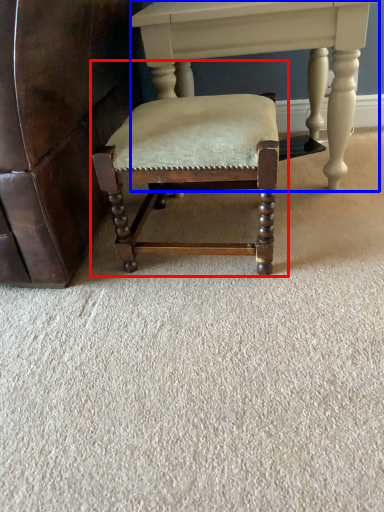
Question: Among these objects, which one is farthest to the camera, chair (highlighted by a red box) or table (highlighted by a blue box)?

Choices:
 (A) chair
 (B) table

Answer: (B)